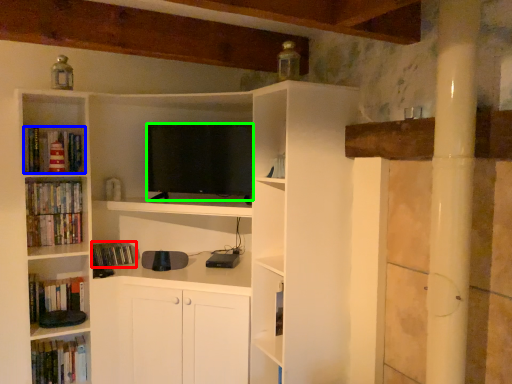
Question: Which object is positioned farthest from book (highlighted by a red box)? Select from book (highlighted by a blue box) and television (highlighted by a green box).

Choices:
 (A) book
 (B) television

Answer: (B)